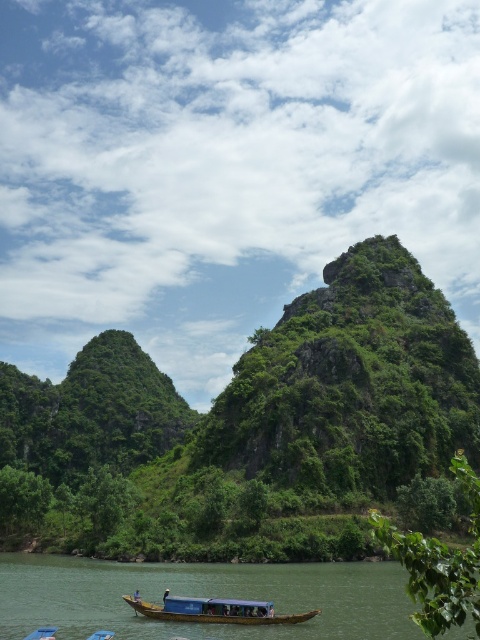
Who is more distant from viewer, (x=44, y=620) or (x=45, y=628)?

Point (x=44, y=620)

Who is positioned more to the right, green wooden boat at lower center or wooden boat at lower center?

green wooden boat at lower center is more to the right.

Which is in front, point (296, 570) or point (52, 636)?

Point (52, 636) is in front.

Find the location of `green wooden boat at lower center`. green wooden boat at lower center is located at coordinates (201, 595).

Is point (160, 573) farther from camera compared to point (292, 620)?

Yes, it is behind point (292, 620).

Between green wooden boat at lower center and blue wooden boat at lower center, which one has more height?

Standing taller between the two is green wooden boat at lower center.

Which is behind, point (384, 604) or point (199, 605)?

The point (384, 604) is more distant.

Where is `green wooden boat at lower center`? green wooden boat at lower center is located at coordinates (201, 595).

Describe the element at coordinates (216, 611) in the screenshot. Image resolution: width=480 pixels, height=640 pixels. I see `blue wooden boat at lower center` at that location.

Who is more distant from viewer, (214, 621) or (29, 634)?

The point (214, 621) is behind.

Does point (200, 604) come behind point (44, 637)?

Yes, point (200, 604) is behind point (44, 637).

This screenshot has height=640, width=480. Identify the location of blue wooden boat at lower center. (216, 611).